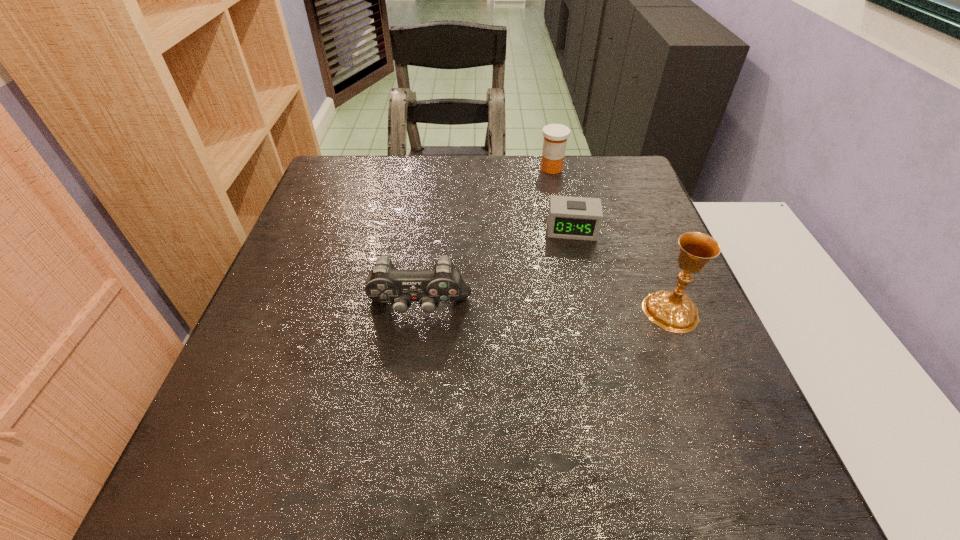
This screenshot has width=960, height=540. I want to click on control, so click(x=385, y=284).

Identify the location of chalice. This screenshot has width=960, height=540. (674, 311).

I want to click on the tallest object, so click(x=674, y=311).

I want to click on the shortest object, so click(579, 218).

At what (x,y) coordinates should I click in order to perform the action: click on the third nearest object. Please return your answer as a coordinate pair (x, y). The height and width of the screenshot is (540, 960). Looking at the image, I should click on (579, 218).

At what (x,y) coordinates should I click in order to perform the action: click on medicine. Please return your answer as a coordinate pair (x, y). The width and height of the screenshot is (960, 540). Looking at the image, I should click on (555, 135).

I want to click on vacant space located on the surface of the control with buttons, so click(x=414, y=347).

Identify the location of vacant area situated 0.370m on the back of the rightmost object. This screenshot has height=540, width=960. (623, 192).

Identify the location of free location located on the front-facing side of the shortest object. (575, 322).

Find the location of `vacant space located 0.060m on the front-facing side of the shortest object`. vacant space located 0.060m on the front-facing side of the shortest object is located at coordinates (572, 258).